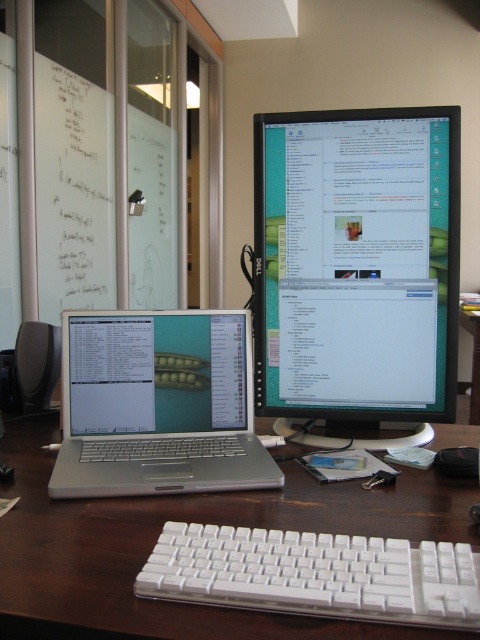
You are sitting at the desk and want to reach the matte black monitor at upper right without moving your chair. Can you do it if your arm can extend 3 feet?

The matte black monitor at upper right is 3.68 feet away from viewer, so your arm can only reach 3 feet, so you cannot reach it without moving your chair.

You are organizing the desk and need to move the white plastic keyboard at lower center to the left. Is there enough space between the matte black monitor at upper right and the edge of the desk to place it there?

The matte black monitor at upper right is positioned on the right side of the white plastic keyboard at lower center, so moving the keyboard to the left would require space to its left. Since the desk has scattered items like a CD case, pen, papers, and a small black device, there might not be enough space. Check the desk layout for clearance.